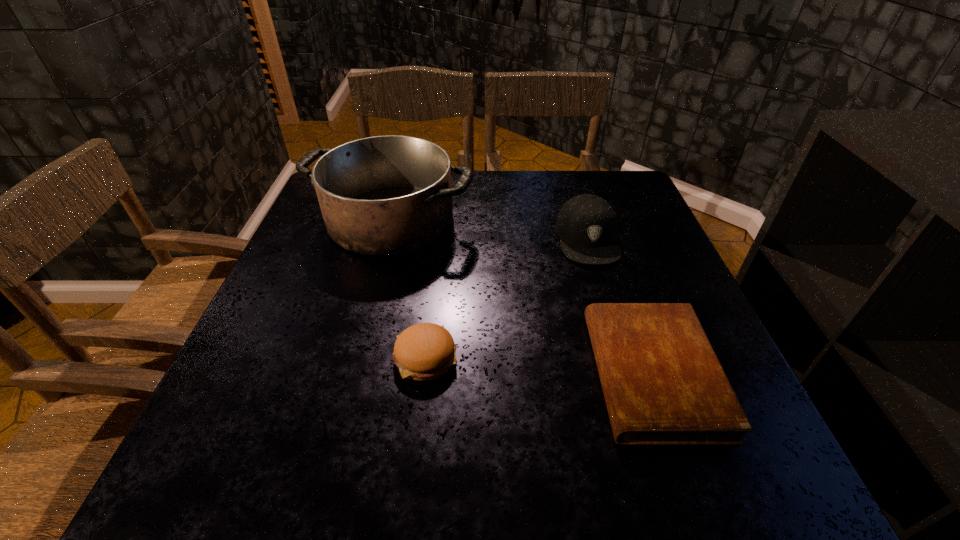
At what (x,y) coordinates should I click in order to perform the action: click on the tallest object. Please return your answer as a coordinate pair (x, y). Looking at the image, I should click on [389, 195].

Locate an element on the screen. the second tallest object is located at coordinates (586, 224).

You are a GUI agent. You are given a task and a screenshot of the screen. Output one action in this format:
    pyautogui.click(x=<x>, y=<y>)
    Task: Click on the patty
    The height and width of the screenshot is (540, 960).
    Given the screenshot: What is the action you would take?
    pyautogui.click(x=425, y=351)

Where is `Bible`? The image size is (960, 540). Bible is located at coordinates (663, 384).

The image size is (960, 540). In order to click on vacant area located 0.320m on the front of the tallest object in this screenshot , I will do `click(350, 371)`.

This screenshot has width=960, height=540. I want to click on free space located 0.240m on the front-facing side of the third shortest object, so click(x=620, y=351).

Locate an element on the screen. This screenshot has width=960, height=540. vacant space located 0.360m on the right of the second shortest object is located at coordinates (650, 356).

At what (x,y) coordinates should I click in order to perform the action: click on vacant space located on the spine side of the shortest object. Please return your answer as a coordinate pair (x, y). The width and height of the screenshot is (960, 540). Looking at the image, I should click on (540, 374).

Where is `free region located 0.130m on the spine side of the shortest object`? free region located 0.130m on the spine side of the shortest object is located at coordinates (524, 374).

Where is `vacant space located on the spine side of the shortest object`? The height and width of the screenshot is (540, 960). vacant space located on the spine side of the shortest object is located at coordinates (424, 374).